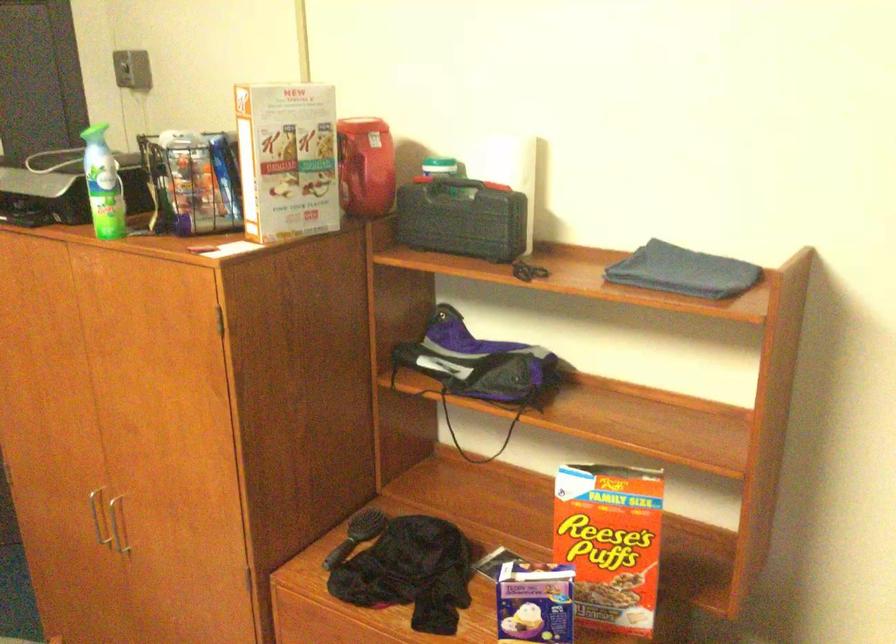
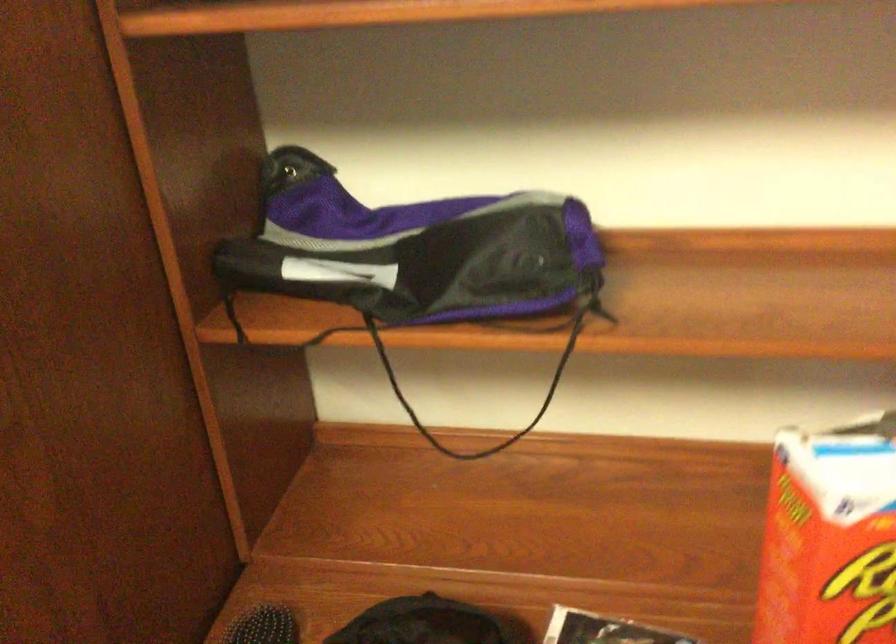
Locate, in the second image, the point that corresponds to (x=555, y=506) in the first image.

(830, 538)